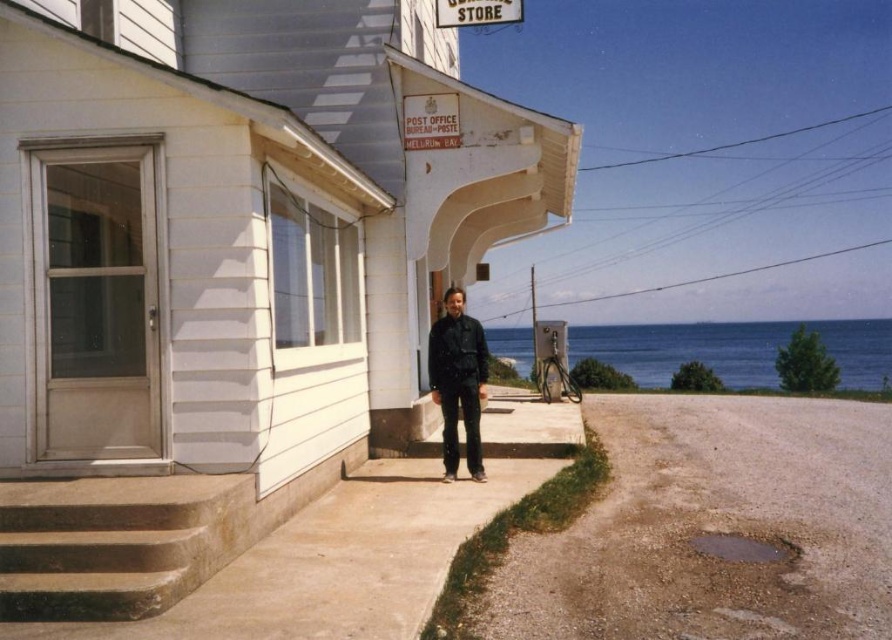
You are a delivery person approaching the POST OFFICE BUREAU DE POSTE in Mellorum Bay. You see the brown concrete stairs at lower left and the black matte jacket at center. Which object is positioned lower in the image?

The brown concrete stairs at lower left are positioned lower in the image than the black matte jacket at center.

You are a visitor to Mellorum Bay and see the POST OFFICE BUREAU DE POSTE. You need to approach the person on the porch wearing the black matte jacket at center. Which direction should you walk to reach them from the blue water at lower right?

Since the blue water at lower right is positioned under the black matte jacket at center, you should walk upward or toward the center to reach the person on the porch wearing the black matte jacket at center from the blue water at lower right.

You are standing on the porch of the Mellorum Bay Post Office Bureau de Poste and want to walk down to the dull gray asphalt at lower right. Is the black matte jacket at center blocking your path?

The dull gray asphalt at lower right is closer to the viewer than the black matte jacket at center, so the black matte jacket at center is behind you and not blocking your path.